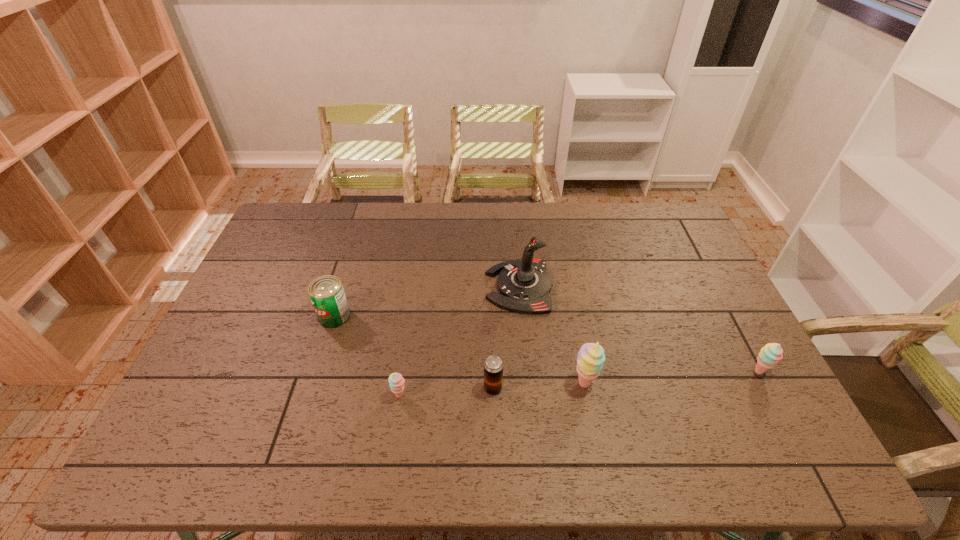
Locate an element on the screen. This screenshot has width=960, height=540. free space located on the back of the second object from right to left is located at coordinates (566, 294).

This screenshot has width=960, height=540. I want to click on free point located on the left of the rightmost object, so click(x=649, y=372).

I want to click on vacant space located 0.160m on the back of the can, so click(x=349, y=269).

Where is `vacant space located on the handle side of the joystick`? vacant space located on the handle side of the joystick is located at coordinates (420, 287).

Where is `vacant area situated on the handle side of the joystick`? This screenshot has height=540, width=960. vacant area situated on the handle side of the joystick is located at coordinates (447, 287).

This screenshot has width=960, height=540. What are the coordinates of `vacant space located 0.180m on the handle side of the joystick` in the screenshot? It's located at (429, 287).

What are the coordinates of `free region located 0.280m on the back of the beer can` in the screenshot? It's located at (491, 302).

Identify the location of beer can that is at the near edge. (493, 366).

Where is `object present at the right edge`? This screenshot has height=540, width=960. object present at the right edge is located at coordinates click(x=771, y=353).

In the image, there is a desktop. Where is `vacant space at the far edge`? This screenshot has height=540, width=960. vacant space at the far edge is located at coordinates (348, 203).